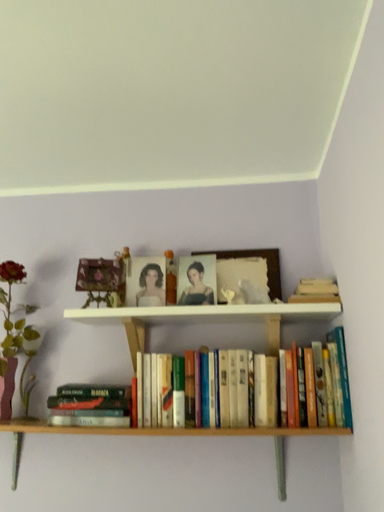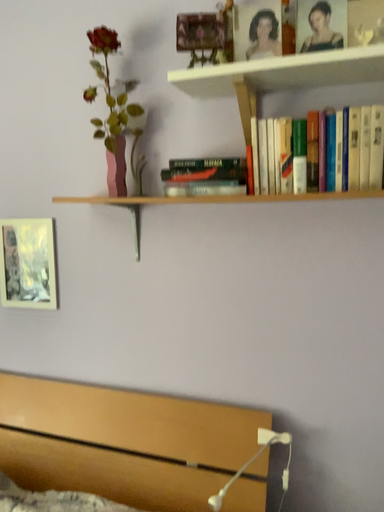
Question: How did the camera likely rotate when shooting the video?

Choices:
 (A) rotated left
 (B) rotated right

Answer: (A)